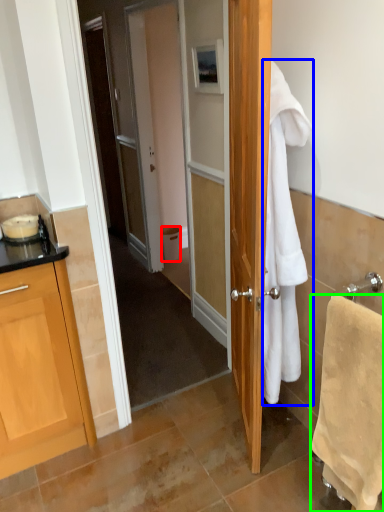
Question: Which object is the closest to the trash bin/can (highlighted by a red box)? Choose among these: towel/napkin (highlighted by a blue box) or towel/napkin (highlighted by a green box).

Choices:
 (A) towel/napkin
 (B) towel/napkin

Answer: (A)